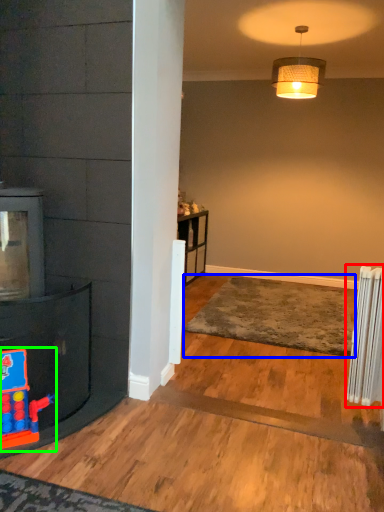
Question: Estimate the real-world distances between objects in this image. Which object is closer to radiator (highlighted by a red box), plain (highlighted by a blue box) or toy (highlighted by a green box)?

Choices:
 (A) plain
 (B) toy

Answer: (A)